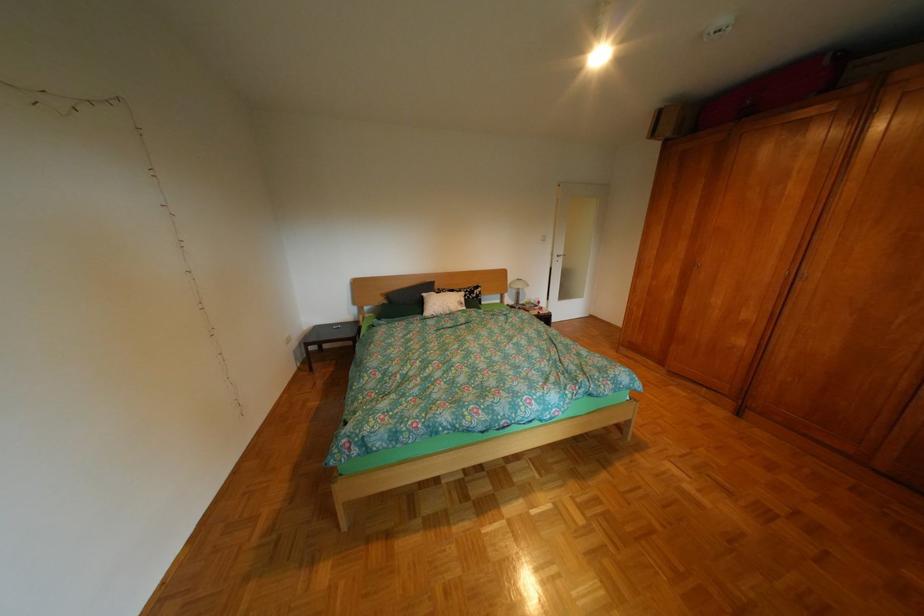
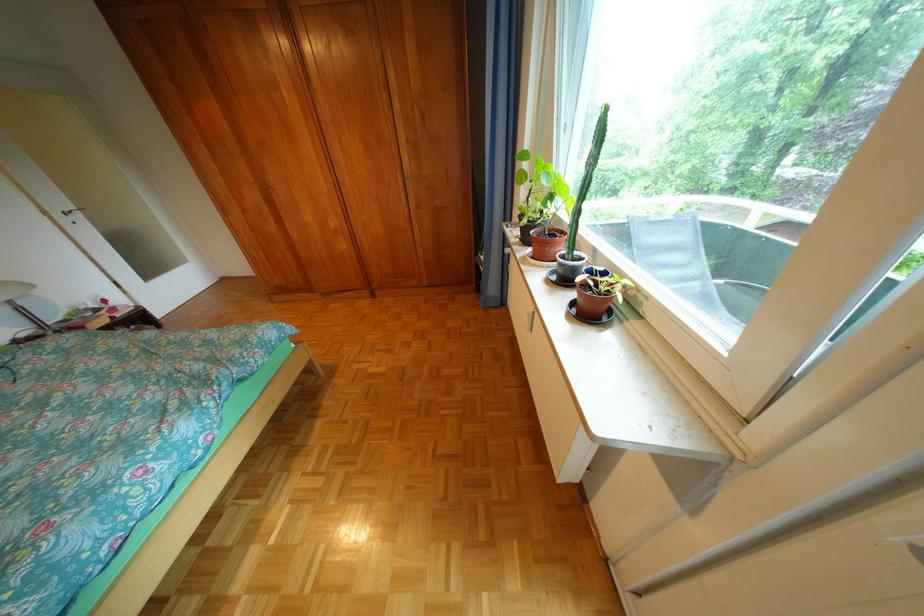
The point at (569, 257) is marked in the first image. Where is the corresponding point in the second image?

(73, 216)